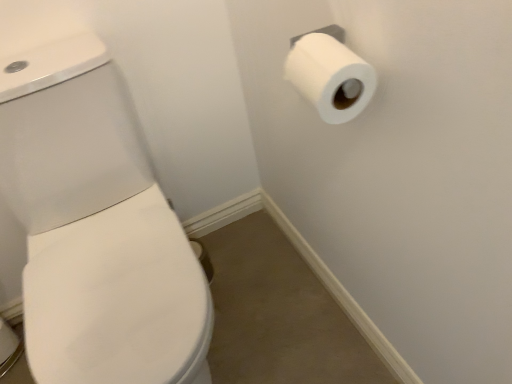
Where is `white matte toilet paper at upper right`? white matte toilet paper at upper right is located at coordinates (330, 77).

What do you see at coordinates (330, 77) in the screenshot? The width and height of the screenshot is (512, 384). I see `white matte toilet paper at upper right` at bounding box center [330, 77].

What are the coordinates of `white matte toilet paper at upper right` in the screenshot? It's located at (330, 77).